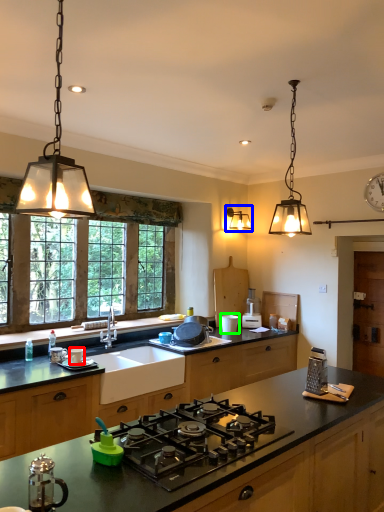
Question: Estimate the real-world distances between objects in this image. Which object is closer to appliance (highlighted by a red box), light fixture (highlighted by a blue box) or appliance (highlighted by a green box)?

Choices:
 (A) light fixture
 (B) appliance

Answer: (B)